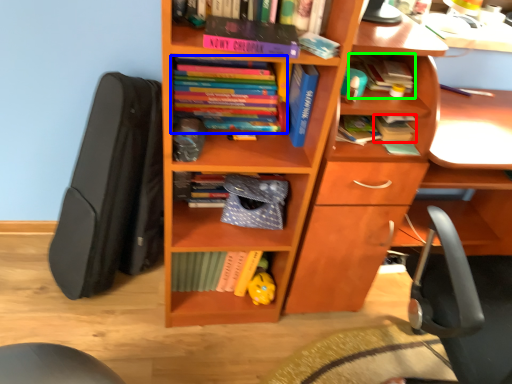
Question: Estimate the real-world distances between objects in this image. Which object is closer to book (highlighted by a red box), book (highlighted by a blue box) or book (highlighted by a green box)?

Choices:
 (A) book
 (B) book

Answer: (B)